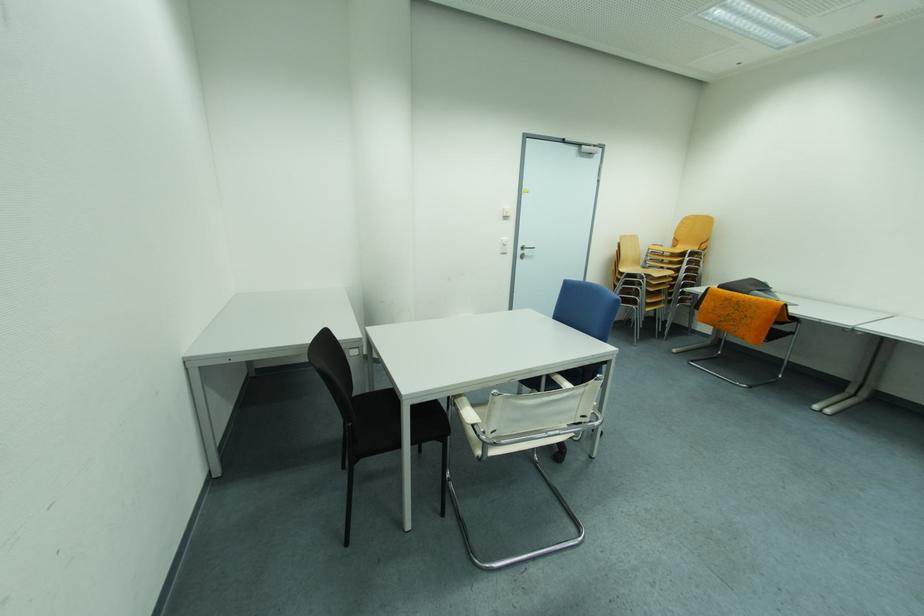
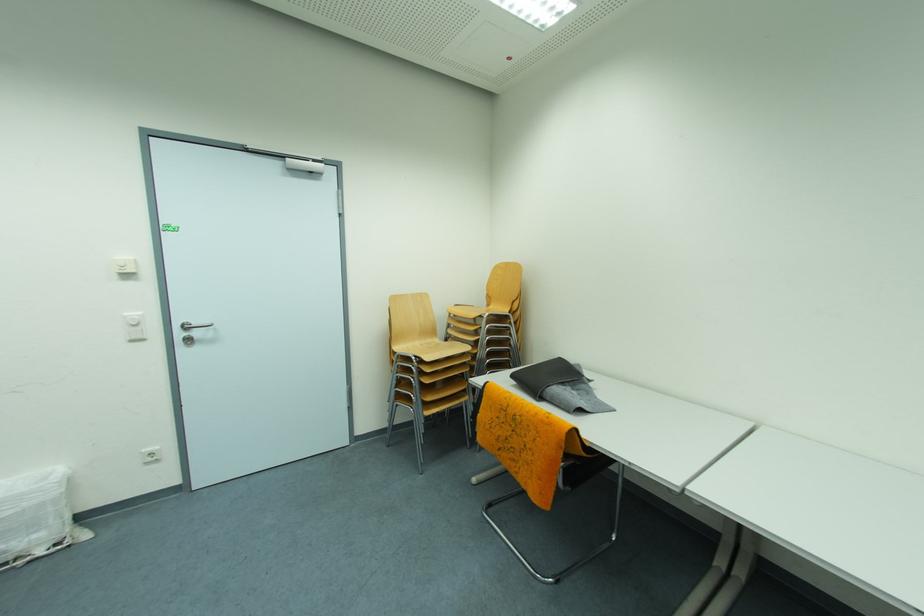
In a continuous first-person perspective shot, in which direction is the camera moving?

The movement direction of the cameraman is right, forward.